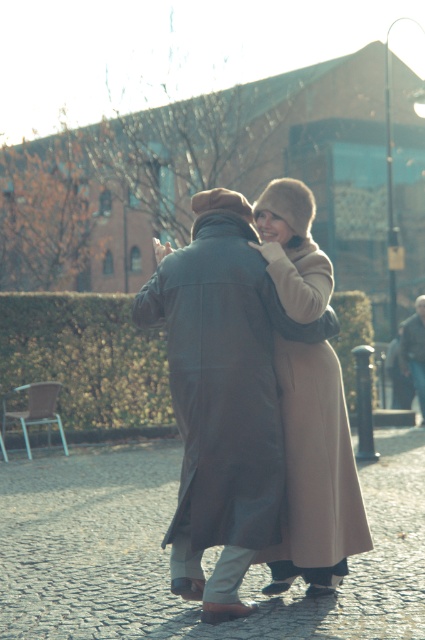
Is point (333, 456) in front of point (410, 333)?

Yes, it is in front of point (410, 333).

Which is below, leather coat at center or leather jacket at center?

leather coat at center is lower down.

Is point (187, 264) closer to camera compared to point (401, 339)?

That is True.

At what (x,y) coordinates should I click in order to perform the action: click on leather coat at center. Please return your answer as a coordinate pair (x, y). Looking at the image, I should click on (254, 397).

Who is positioned more to the left, beige wool coat at center or leather jacket at center?

beige wool coat at center

Does point (326, 525) come in front of point (416, 326)?

Yes, it is.

Identify the location of beige wool coat at center. (316, 472).

Between leather coat at center and beige wool coat at center, which one is positioned higher?

leather coat at center

In the scene shown: Does leather coat at center have a lesser height compared to beige wool coat at center?

In fact, leather coat at center may be taller than beige wool coat at center.

Where is `leather coat at center`? The width and height of the screenshot is (425, 640). leather coat at center is located at coordinates point(254,397).